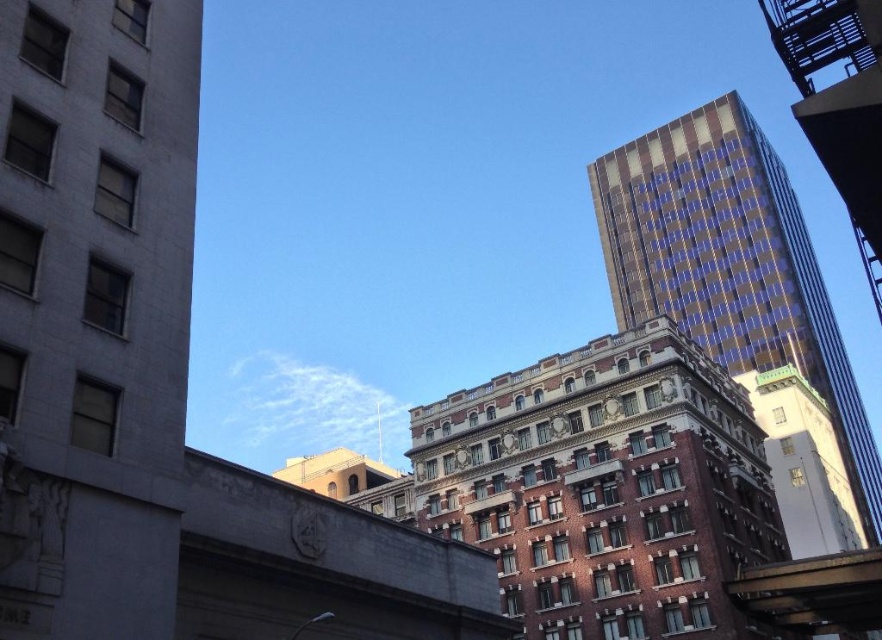
Question: Which of the following is the farthest from the observer?

Choices:
 (A) (45, 624)
 (B) (606, 211)

Answer: (B)

Question: Is gray concrete building at left below gold and blue glass skyscraper at upper right?

Choices:
 (A) yes
 (B) no

Answer: (A)

Question: Which point is farther from the camera taking this photo?

Choices:
 (A) (772, 234)
 (B) (126, 445)

Answer: (A)

Question: Can you confirm if gray concrete building at left is positioned above gold and blue glass skyscraper at upper right?

Choices:
 (A) no
 (B) yes

Answer: (A)

Question: Can you confirm if gray concrete building at left is positioned to the left of gold and blue glass skyscraper at upper right?

Choices:
 (A) yes
 (B) no

Answer: (A)